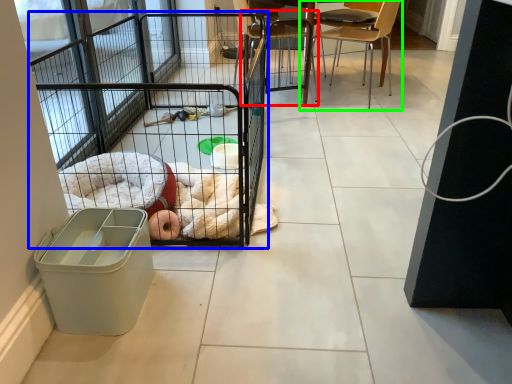
Question: Which object is positioned farthest from chair (highlighted by a red box)? Select from cage (highlighted by a blue box) and chair (highlighted by a green box).

Choices:
 (A) cage
 (B) chair

Answer: (A)